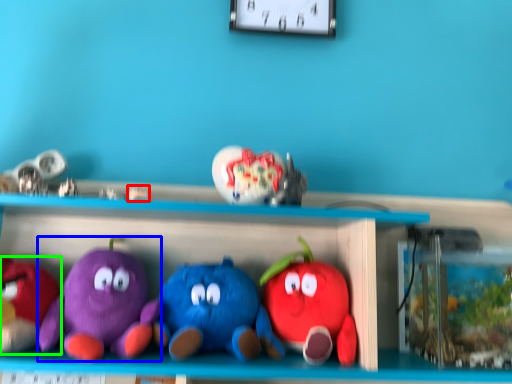
Question: Which is nearer to the toy (highlighted by a red box)? toy (highlighted by a blue box) or toy (highlighted by a green box).

Choices:
 (A) toy
 (B) toy

Answer: (A)